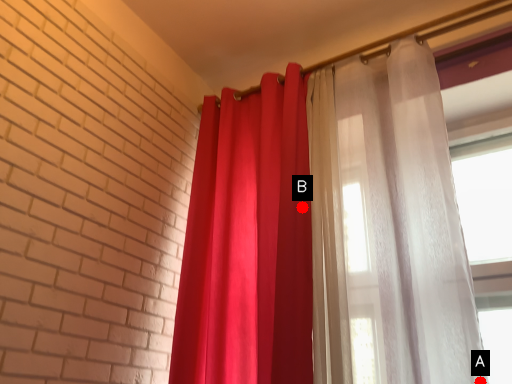
Question: Two points are circled on the image, labeled by A and B beside each circle. Which point is closer to the camera?

Choices:
 (A) A is closer
 (B) B is closer

Answer: (A)